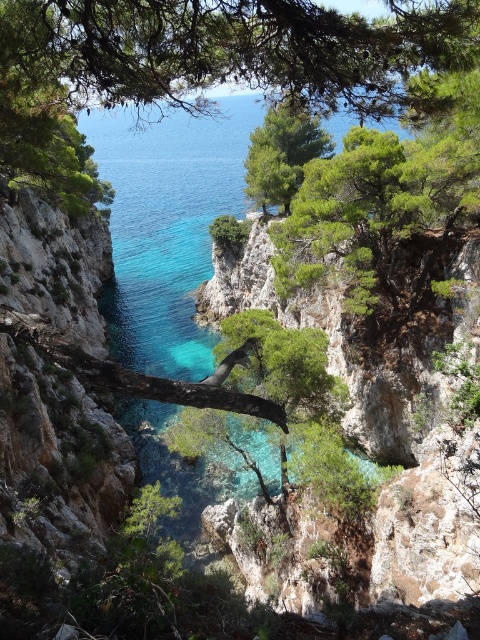
You are standing at the viewpoint and want to take a photo of both the point at coordinates [123,92] and the point at coordinates [297,161]. Which point will appear larger in your photo?

Point [123,92] will appear larger in the photo because it is closer to the camera than point [297,161].

From the picture: You are standing at the edge of the cliff in the coastal landscape scene. You see a point marked at coordinates (229, 51). Which object from the scene is located at that point?

The point at coordinates (229, 51) corresponds to the green leafy tree at upper center.

You are an environmental scientist assessing the coastal area. You observe the green leafy tree at upper center and the green leafy tree at center. Which tree is closer to the cliff face described in the scene?

The green leafy tree at upper center is positioned under the green leafy tree at center, meaning it is closer to the cliff face since it is located beneath the other tree in the scene.